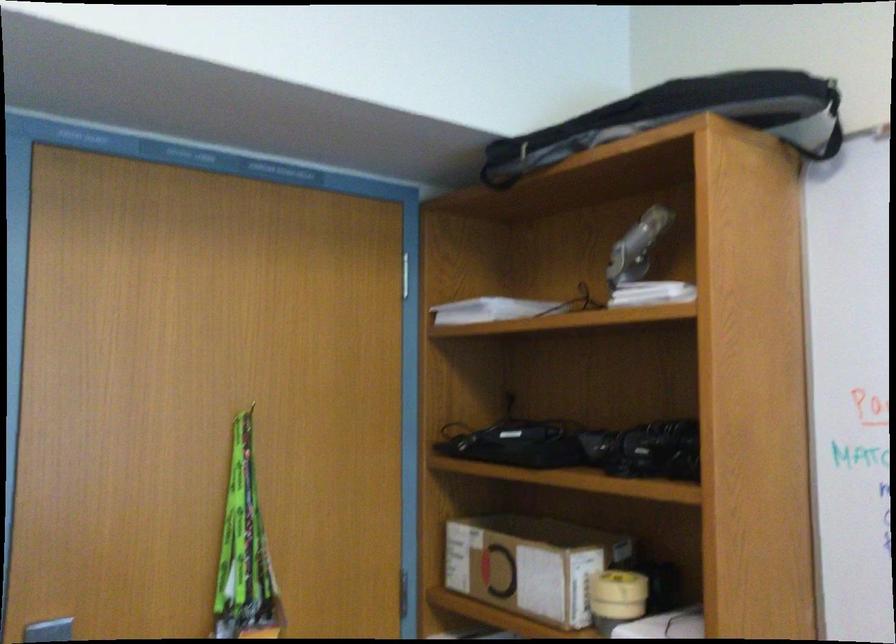
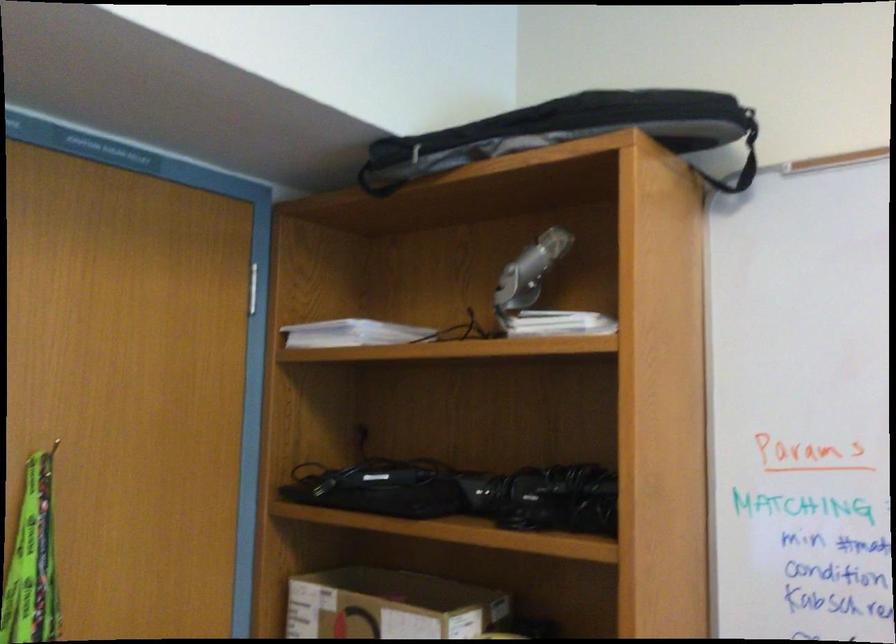
Find the pixel in the second image that matches [247,409] in the first image.

(53, 448)